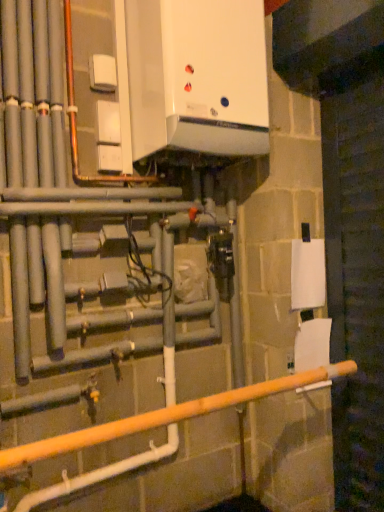
Question: From the image's perspective, does white matte toilet paper at lower right, the first toilet paper from the bottom, appear higher than wooden pole at lower center?

Choices:
 (A) no
 (B) yes

Answer: (B)

Question: Does white matte toilet paper at lower right, which is counted as the 2th toilet paper, starting from the top, have a greater width compared to wooden pole at lower center?

Choices:
 (A) no
 (B) yes

Answer: (A)

Question: Can you confirm if white matte toilet paper at lower right, the first toilet paper from the bottom, is positioned to the right of wooden pole at lower center?

Choices:
 (A) no
 (B) yes

Answer: (B)

Question: Is wooden pole at lower center inside white matte toilet paper at lower right, which is counted as the 2th toilet paper, starting from the top?

Choices:
 (A) no
 (B) yes

Answer: (A)

Question: From a real-world perspective, is white matte toilet paper at lower right, the first toilet paper from the bottom, physically above wooden pole at lower center?

Choices:
 (A) yes
 (B) no

Answer: (A)

Question: Relative to wooden pole at lower center, is white glossy boiler at upper center in front or behind?

Choices:
 (A) behind
 (B) front

Answer: (A)

Question: Considering the positions of white glossy boiler at upper center and wooden pole at lower center in the image, is white glossy boiler at upper center wider or thinner than wooden pole at lower center?

Choices:
 (A) thin
 (B) wide

Answer: (B)

Question: Is point (142, 60) closer or farther from the camera than point (304, 384)?

Choices:
 (A) farther
 (B) closer

Answer: (B)

Question: From their relative heights in the image, would you say white glossy boiler at upper center is taller or shorter than wooden pole at lower center?

Choices:
 (A) short
 (B) tall

Answer: (B)

Question: Is white matte toilet paper at right, which is the second toilet paper from bottom to top, taller or shorter than white glossy boiler at upper center?

Choices:
 (A) tall
 (B) short

Answer: (B)

Question: From a real-world perspective, is white matte toilet paper at right, which is the second toilet paper from bottom to top, above or below white glossy boiler at upper center?

Choices:
 (A) below
 (B) above

Answer: (A)

Question: From the image's perspective, relative to white glossy boiler at upper center, is white matte toilet paper at right, which appears as the first toilet paper when viewed from the top, above or below?

Choices:
 (A) above
 (B) below

Answer: (B)

Question: In terms of size, does white matte toilet paper at right, which is the second toilet paper from bottom to top, appear bigger or smaller than white glossy boiler at upper center?

Choices:
 (A) big
 (B) small

Answer: (B)

Question: From a real-world perspective, relative to white matte toilet paper at right, which is the second toilet paper from bottom to top, is white glossy boiler at upper center vertically above or below?

Choices:
 (A) above
 (B) below

Answer: (A)

Question: From their relative heights in the image, would you say white glossy boiler at upper center is taller or shorter than white matte toilet paper at right, which is the second toilet paper from bottom to top?

Choices:
 (A) tall
 (B) short

Answer: (A)